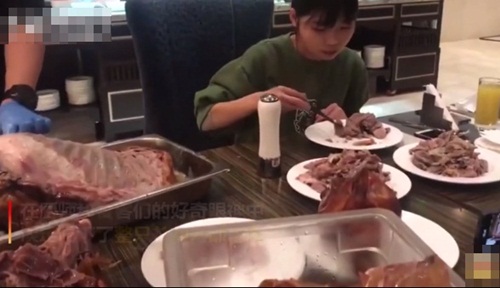
This screenshot has width=500, height=288. In order to click on plates on table in this screenshot , I will do `click(436, 232)`, `click(149, 272)`, `click(305, 172)`, `click(337, 126)`, `click(455, 158)`.